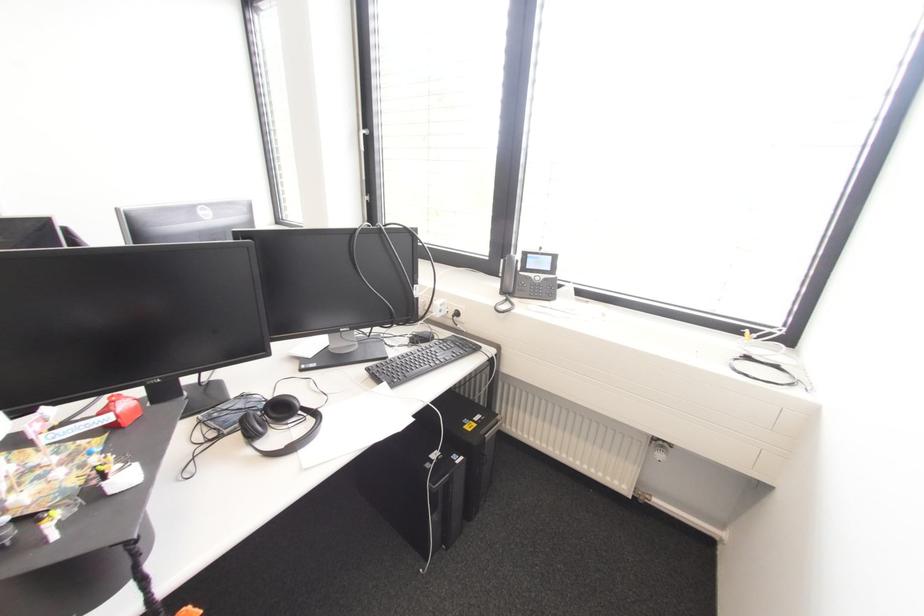
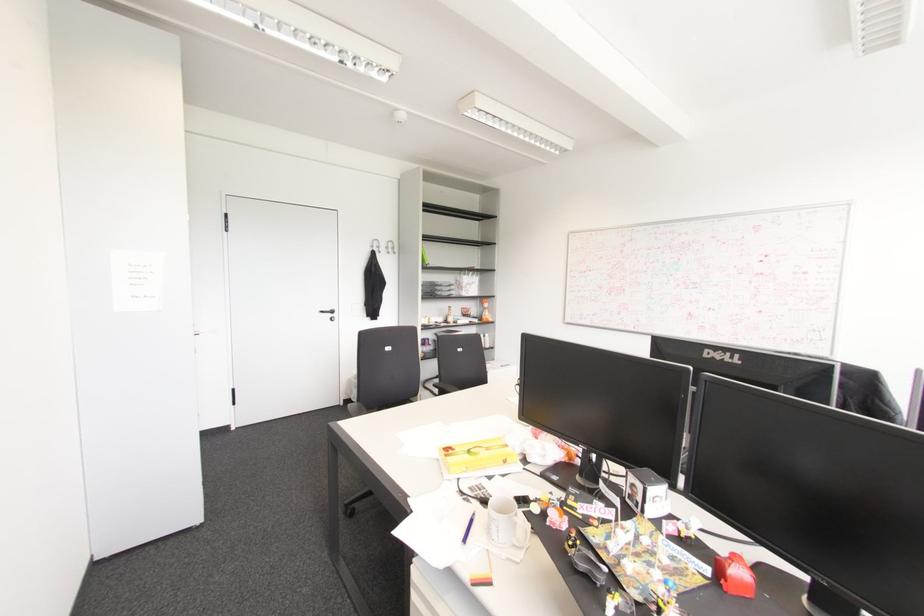
Find the pixel in the second image that matches point (124, 403) in the first image.

(740, 570)